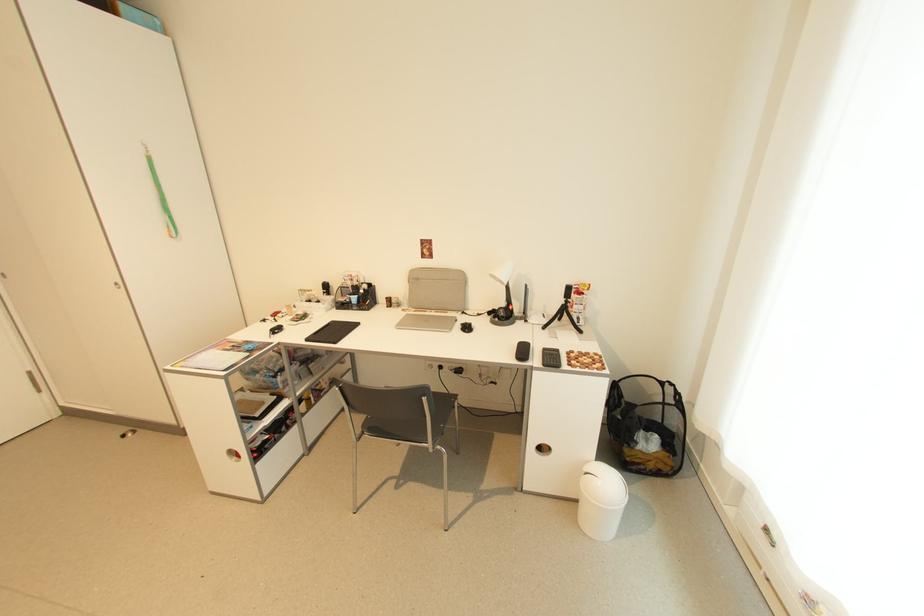
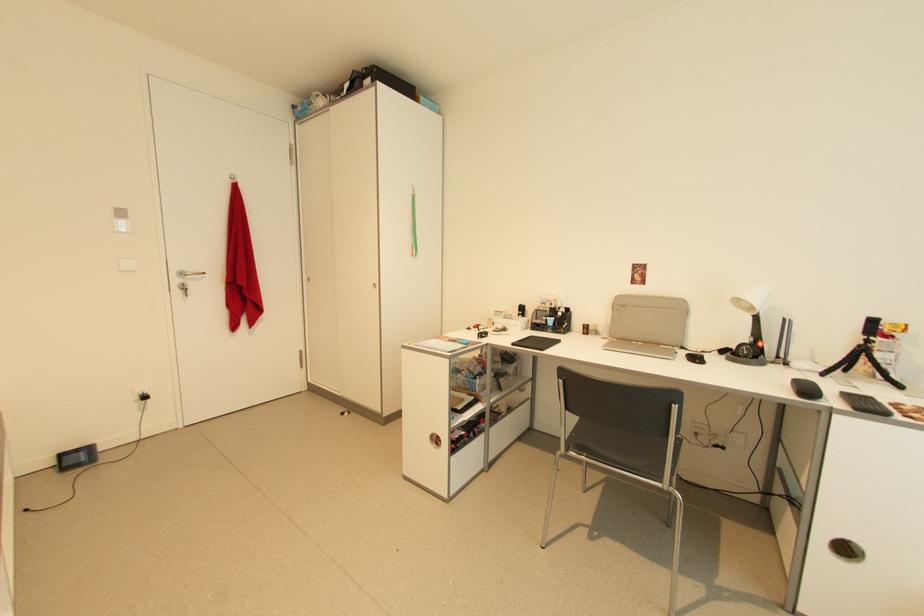
Question: The images are taken continuously from a first-person perspective. In which direction are you moving?

Choices:
 (A) Left
 (B) Right
 (C) Forward
 (D) Backward

Answer: (A)